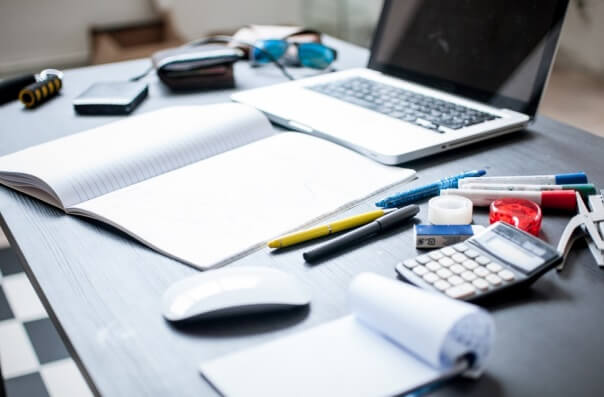
Where is `black/white tile floor`? black/white tile floor is located at coordinates (60, 380), (34, 380), (27, 344), (40, 334), (4, 311), (34, 305), (17, 263), (4, 238).